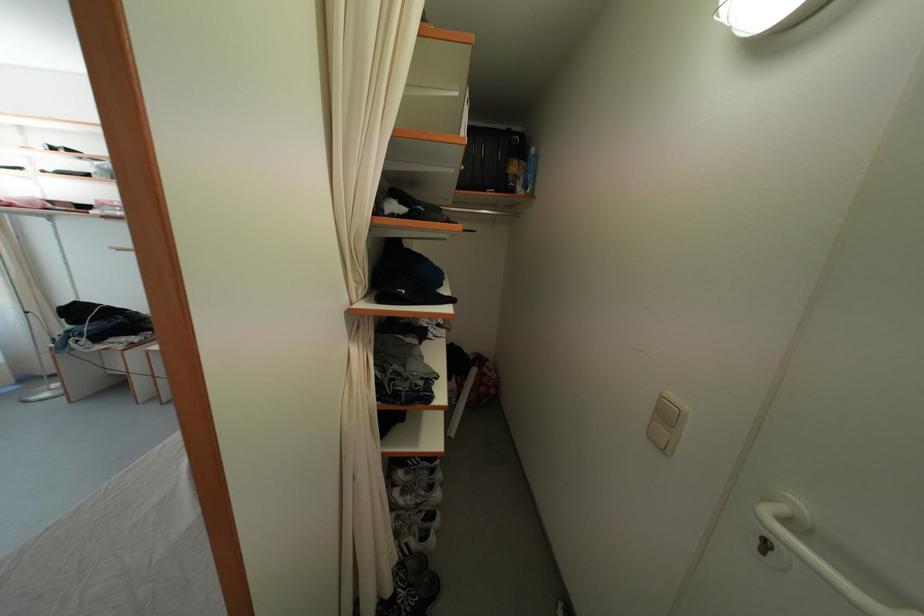
The image size is (924, 616). I want to click on blue spray can, so click(529, 171).